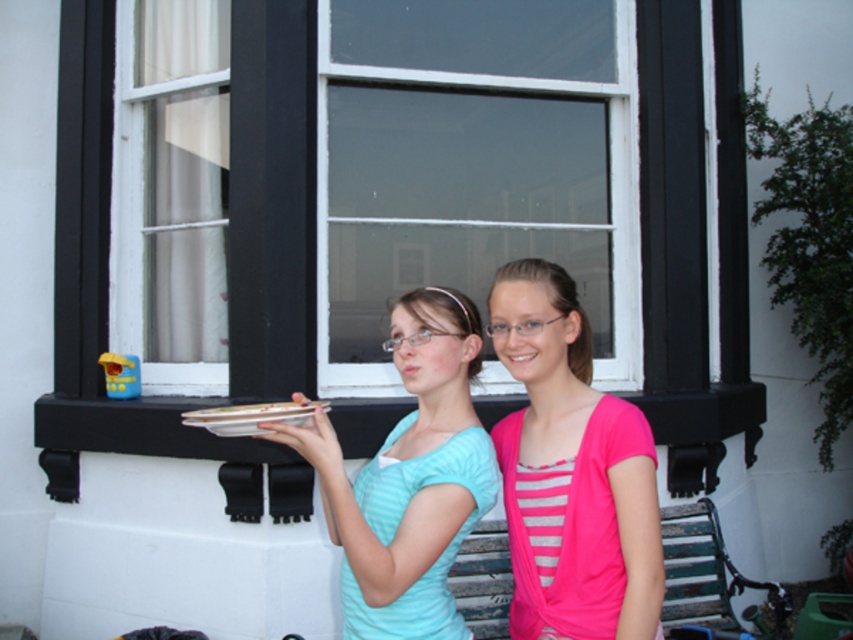
You are a photographer trying to capture both the light blue striped shirt at center and the white glossy platter at center in the same frame. Based on their sizes, which object should you focus on first to ensure both are in focus?

The light blue striped shirt at center is much taller than the white glossy platter at center, so you should focus on the light blue striped shirt at center first to ensure both are in focus.

You are a delivery person who needs to place a white glossy platter at center on a surface that is not the white plastic window at center. According to the scene, where could you place it?

The white glossy platter at center can be placed on the textured lower part of the wall since it is below the white plastic window at center and the description states the window is above the platter.

You are standing in front of the building with the large window. There are two points marked on the ground. The first point is at coordinate point (355, 528) and the second is at point (229, 428). If you want to walk towards the point that is closer to the building, which coordinate point should you walk towards?

Point (355, 528) is in front of point (229, 428), so the point closer to the building is point (229, 428). Therefore, you should walk towards point (229, 428).